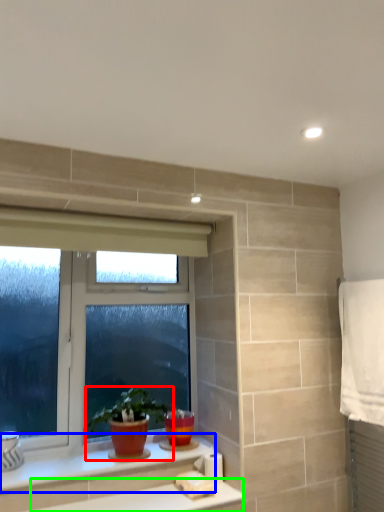
Question: Which is nearer to the houseplant (highlighted by a red box)? counter top (highlighted by a blue box) or counter top (highlighted by a green box).

Choices:
 (A) counter top
 (B) counter top

Answer: (A)